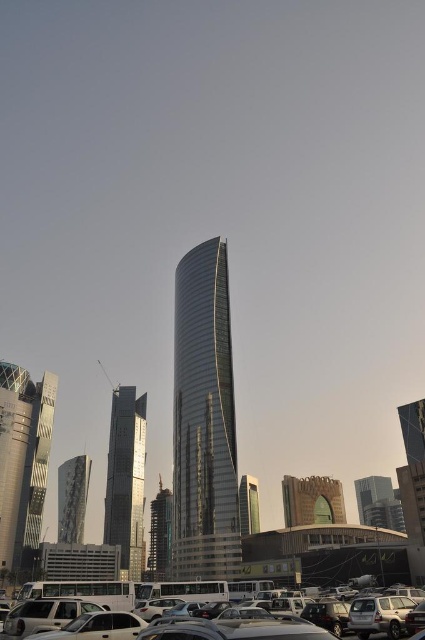
Question: Can you confirm if dark gray asphalt parking lot at lower center is positioned to the right of brown textured building at lower center?

Choices:
 (A) no
 (B) yes

Answer: (A)

Question: Can you confirm if dark gray asphalt parking lot at lower center is positioned below brown textured building at lower center?

Choices:
 (A) no
 (B) yes

Answer: (A)

Question: Can you confirm if brown textured building at lower center is positioned below metallic glass tower at center?

Choices:
 (A) yes
 (B) no

Answer: (B)

Question: Which of the following is the closest to the observer?

Choices:
 (A) (203, 417)
 (B) (133, 532)

Answer: (A)

Question: Which object is the closest to the reflective glass tower at center?

Choices:
 (A) metallic glass tower at center
 (B) brown textured building at lower center
 (C) shiny glass skyscraper at center
 (D) metallic glass skyscraper at left

Answer: (A)

Question: Estimate the real-world distances between objects in this image. Which object is closer to the metallic glass tower at center?

Choices:
 (A) reflective glass tower at center
 (B) shiny glass skyscraper at center
 (C) silver glass skyscraper at center
 (D) dark gray asphalt parking lot at lower center

Answer: (C)